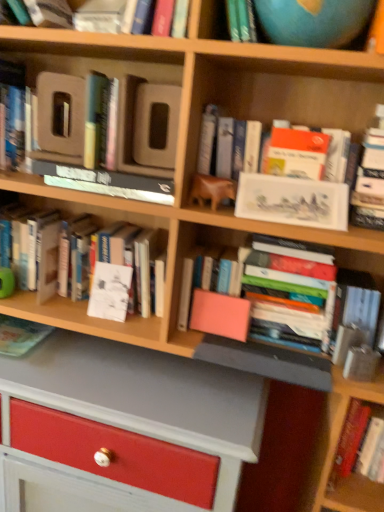
From the picture: Measure the distance between hardcover book at lower right, the 1th book positioned from the bottom, and camera.

A distance of 1.00 meters exists between hardcover book at lower right, the 1th book positioned from the bottom, and camera.

Identify the location of hardcover book at lower right, which is counted as the 6th book, starting from the top. Image resolution: width=384 pixels, height=512 pixels. (350, 440).

What do you see at coordinates (292, 201) in the screenshot? This screenshot has height=512, width=384. I see `matte white painting at upper right, marked as the 3th paperback book in a bottom-to-top arrangement` at bounding box center [292, 201].

Describe the element at coordinates (105, 182) in the screenshot. The width and height of the screenshot is (384, 512). I see `hardcover book at upper left, which appears as the third book when viewed from the top` at that location.

In order to click on hardcover book at lower right, the 1th book positioned from the bottom in this screenshot , I will do `click(350, 440)`.

How many degrees apart are the facing directions of white paper at center, the 3th book when ordered from bottom to top, and pink matte book at center, which is counted as the second paperback book, starting from the right?

They differ by 7.29 degrees in their facing directions.

How much distance is there between white paper at center, the 4th book in the top-to-bottom sequence, and pink matte book at center, which is the 1th paperback book from bottom to top?

The distance of white paper at center, the 4th book in the top-to-bottom sequence, from pink matte book at center, which is the 1th paperback book from bottom to top, is 11.58 inches.

Is white paper at center, the 4th book in the top-to-bottom sequence, looking in the opposite direction of pink matte book at center, the 2th paperback book in the left-to-right sequence?

white paper at center, the 4th book in the top-to-bottom sequence, does not have its back to pink matte book at center, the 2th paperback book in the left-to-right sequence.

Which is correct: white paper at center, the 3th book when ordered from bottom to top, is inside pink matte book at center, positioned as the second paperback book in front-to-back order, or outside of it?

white paper at center, the 3th book when ordered from bottom to top, lies outside pink matte book at center, positioned as the second paperback book in front-to-back order.

Looking at the image, does white paper at center, the 3th book when ordered from bottom to top, seem bigger or smaller compared to hardcover book at left, the 1th book positioned from the top?

Considering their sizes, white paper at center, the 3th book when ordered from bottom to top, takes up more space than hardcover book at left, the 1th book positioned from the top.

Is white paper at center, the 4th book in the top-to-bottom sequence, far from hardcover book at left, the 1th book positioned from the top?

That's not correct — white paper at center, the 4th book in the top-to-bottom sequence, is a little close to hardcover book at left, the 1th book positioned from the top.

From the image's perspective, is white paper at center, the 4th book in the top-to-bottom sequence, on hardcover book at left, the 1th book positioned from the top?

No, from the image's perspective, white paper at center, the 4th book in the top-to-bottom sequence, is not above hardcover book at left, the 1th book positioned from the top.

In order to click on the 1st book to the right of the hardcover book at left, the sixth book from the bottom, counting from the anchor's position in this screenshot , I will do `click(51, 264)`.

Is hardcover book at lower right, the 1th book positioned from the bottom, at the right side of white glossy book at upper center, the 5th book when ordered from bottom to top?

Yes, hardcover book at lower right, the 1th book positioned from the bottom, is to the right of white glossy book at upper center, the 5th book when ordered from bottom to top.

Consider the image. Is white glossy book at upper center, the 5th book when ordered from bottom to top, at the back of hardcover book at lower right, the 1th book positioned from the bottom?

No, white glossy book at upper center, the 5th book when ordered from bottom to top, is not at the back of hardcover book at lower right, the 1th book positioned from the bottom.

Considering the sizes of objects hardcover book at lower right, the 1th book positioned from the bottom, and white glossy book at upper center, the 5th book when ordered from bottom to top, in the image provided, who is taller, hardcover book at lower right, the 1th book positioned from the bottom, or white glossy book at upper center, the 5th book when ordered from bottom to top,?

Standing taller between the two is white glossy book at upper center, the 5th book when ordered from bottom to top.

From a real-world perspective, between hardcover book at lower right, which is counted as the 6th book, starting from the top, and white glossy book at upper center, acting as the second book starting from the top, who is vertically higher?

white glossy book at upper center, acting as the second book starting from the top, is physically above.

How many degrees apart are the facing directions of hardcover book at upper left, which appears as the third book when viewed from the top, and hardcover book at lower right, which is counted as the 6th book, starting from the top?

They differ by 0.00627 degrees in their facing directions.

Where is `the 1st book behind the hardcover book at upper left, which appears as the third book when viewed from the top, counting from the anchor's position`? This screenshot has width=384, height=512. the 1st book behind the hardcover book at upper left, which appears as the third book when viewed from the top, counting from the anchor's position is located at coordinates (350, 440).

In terms of width, does hardcover book at upper left, which appears as the third book when viewed from the top, look wider or thinner when compared to hardcover book at lower right, the 1th book positioned from the bottom?

Considering their sizes, hardcover book at upper left, which appears as the third book when viewed from the top, looks broader than hardcover book at lower right, the 1th book positioned from the bottom.

Consider the image. Is hardcover book at upper left, which appears as the third book when viewed from the top, positioned in front of hardcover book at lower right, which is counted as the 6th book, starting from the top?

Yes.

In the scene shown: Would you say matte green book at lower left, the fifth book in the top-to-bottom sequence, is a long distance from white glossy book at upper center, acting as the second book starting from the top?

matte green book at lower left, the fifth book in the top-to-bottom sequence, is near white glossy book at upper center, acting as the second book starting from the top, not far away.

In the scene shown: From a real-world perspective, does matte green book at lower left, the fifth book in the top-to-bottom sequence, stand above white glossy book at upper center, the 5th book when ordered from bottom to top?

Actually, matte green book at lower left, the fifth book in the top-to-bottom sequence, is physically below white glossy book at upper center, the 5th book when ordered from bottom to top, in the real world.

How many degrees apart are the facing directions of matte green book at lower left, the fifth book in the top-to-bottom sequence, and white glossy book at upper center, the 5th book when ordered from bottom to top?

matte green book at lower left, the fifth book in the top-to-bottom sequence, and white glossy book at upper center, the 5th book when ordered from bottom to top, are facing 2.75 degrees away from each other.

Is hardcover book at lower right, the 1th book positioned from the bottom, completely or partially inside pink matte book at center, which is the 1th paperback book from bottom to top?

That's incorrect, hardcover book at lower right, the 1th book positioned from the bottom, is not inside pink matte book at center, which is the 1th paperback book from bottom to top.

Looking at this image, is pink matte book at center, marked as the 3th paperback book in a top-to-bottom arrangement, to the left or to the right of hardcover book at lower right, which is counted as the 6th book, starting from the top, in the image?

In the image, pink matte book at center, marked as the 3th paperback book in a top-to-bottom arrangement, appears on the left side of hardcover book at lower right, which is counted as the 6th book, starting from the top.

Which object is closer to the camera, pink matte book at center, which is the second paperback book in back-to-front order, or hardcover book at lower right, which is counted as the 6th book, starting from the top?

hardcover book at lower right, which is counted as the 6th book, starting from the top, is in front.

Where is `the 2nd book counting from the right side of the pink matte book at center, marked as the 3th paperback book in a top-to-bottom arrangement`? The height and width of the screenshot is (512, 384). the 2nd book counting from the right side of the pink matte book at center, marked as the 3th paperback book in a top-to-bottom arrangement is located at coordinates (350, 440).

Which object is closer to the camera, pink matte book at center, the 2th paperback book in the left-to-right sequence, or hardcover book at upper left, which appears as the third book when viewed from the top?

hardcover book at upper left, which appears as the third book when viewed from the top, is in front.

Between pink matte book at center, positioned as the second paperback book in front-to-back order, and hardcover book at upper left, which appears as the third book when viewed from the top, which one appears on the left side from the viewer's perspective?

hardcover book at upper left, which appears as the third book when viewed from the top, is more to the left.

How far apart are pink matte book at center, positioned as the second paperback book in front-to-back order, and hardcover book at upper left, which appears as the third book when viewed from the top?

A distance of 13.35 inches exists between pink matte book at center, positioned as the second paperback book in front-to-back order, and hardcover book at upper left, which appears as the third book when viewed from the top.

Between point (221, 313) and point (72, 174), which one is positioned behind?

The point (221, 313) is farther from the camera.

From the image's perspective, count 2nd paperback books downward from the white paper at center, the 4th book in the top-to-bottom sequence, and point to it. Please provide its 2D coordinates.

[(220, 315)]

Locate an element on the screen. The image size is (384, 512). book that is the 3rd object directly below the hardcover book at left, the 1th book positioned from the top (from a real-world perspective) is located at coordinates (51, 264).

From the image, which object appears to be farther from hardcover book at upper left, the fourth book ordered from the bottom, matte green book at lower left, positioned as the 2th book in bottom-to-top order, or hardcover book at lower right, which is counted as the 6th book, starting from the top?

Among the two, hardcover book at lower right, which is counted as the 6th book, starting from the top, is located further to hardcover book at upper left, the fourth book ordered from the bottom.

Estimate the real-world distances between objects in this image. Which object is further from hardcover book at upper left, the fourth book ordered from the bottom, matte white painting at upper right, marked as the 3th paperback book in a bottom-to-top arrangement, or matte green book at lower left, positioned as the 2th book in bottom-to-top order?

matte green book at lower left, positioned as the 2th book in bottom-to-top order, is further to hardcover book at upper left, the fourth book ordered from the bottom.

When comparing their distances from blue matte globe at upper right, does hardcover book at left, the 1th book positioned from the top, or white paper at center, arranged as the 3th paperback book when viewed from the front, seem further?

white paper at center, arranged as the 3th paperback book when viewed from the front, lies further to blue matte globe at upper right than the other object.

Which object lies further to the anchor point white paper at center, arranged as the second paperback book when ordered from the bottom, white glossy book at upper center, the 5th book when ordered from bottom to top, or hardcover book at upper left, which appears as the third book when viewed from the top?

Among the two, white glossy book at upper center, the 5th book when ordered from bottom to top, is located further to white paper at center, arranged as the second paperback book when ordered from the bottom.

From the image, which object appears to be farther from hardcover book at left, the 1th book positioned from the top, white glossy book at upper center, the 5th book when ordered from bottom to top, or white paper at center, the 3th book when ordered from bottom to top?

Based on the image, white glossy book at upper center, the 5th book when ordered from bottom to top, appears to be further to hardcover book at left, the 1th book positioned from the top.

Considering their positions, is white paper at center, the 4th book in the top-to-bottom sequence, positioned closer to matte white painting at upper right, the third paperback book positioned from the left, than hardcover book at upper left, the fourth book ordered from the bottom?

hardcover book at upper left, the fourth book ordered from the bottom, is closer to matte white painting at upper right, the third paperback book positioned from the left.

Looking at the image, which one is located closer to matte white painting at upper right, which is the first paperback book from right to left, matte green book at lower left, positioned as the 2th book in bottom-to-top order, or hardcover book at left, the 1th book positioned from the top?

hardcover book at left, the 1th book positioned from the top, is closer to matte white painting at upper right, which is the first paperback book from right to left.

When comparing their distances from hardcover book at upper left, the fourth book ordered from the bottom, does matte green book at lower left, the fifth book in the top-to-bottom sequence, or blue matte globe at upper right seem closer?

blue matte globe at upper right.

The width and height of the screenshot is (384, 512). In order to click on book between hardcover book at upper left, which appears as the third book when viewed from the top, and white paper at center, arranged as the 1th paperback book when viewed from the left, vertically in this screenshot , I will do pos(51,264).

Image resolution: width=384 pixels, height=512 pixels. Identify the location of paperback book between blue matte globe at upper right and white paper at center, arranged as the 1th paperback book when viewed from the left, in the up-down direction. (292, 201).

Locate an element on the screen. paperback book between white paper at center, which is counted as the third paperback book, starting from the right, and white glossy book at upper center, acting as the second book starting from the top, from left to right is located at coordinates (220, 315).

Locate an element on the screen. paperback book situated between matte green book at lower left, the fifth book in the top-to-bottom sequence, and white paper at center, the 3th book when ordered from bottom to top, from left to right is located at coordinates (110, 291).